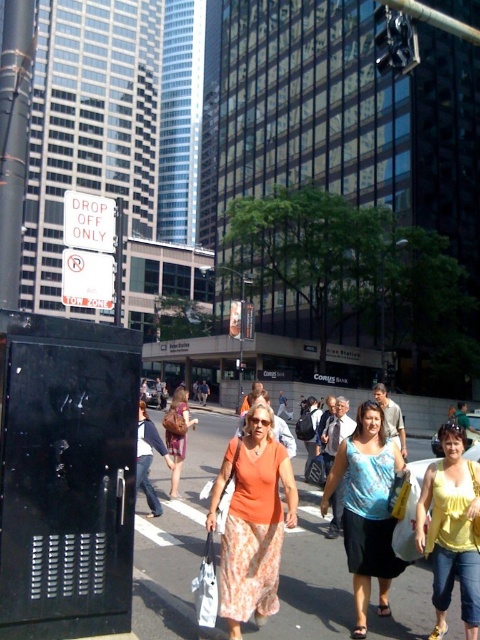
Question: Which point is closer to the camera?

Choices:
 (A) (187, 404)
 (B) (206, 392)
 (C) (213, 616)

Answer: (C)

Question: From the image, what is the correct spatial relationship of yellow cotton tank top at lower right in relation to brown leather backpack at center?

Choices:
 (A) right
 (B) left

Answer: (A)

Question: Does white fabric bag at center have a larger size compared to orange t-shirt at center?

Choices:
 (A) no
 (B) yes

Answer: (A)

Question: Can you confirm if orange cotton shirt at center is thinner than orange t-shirt at center?

Choices:
 (A) yes
 (B) no

Answer: (B)

Question: Which point appears closest to the camera in this image?

Choices:
 (A) (361, 460)
 (B) (162, 396)
 (C) (263, 406)
 (D) (137, 460)

Answer: (C)

Question: Which point is closer to the camera?

Choices:
 (A) (152, 426)
 (B) (202, 381)

Answer: (A)